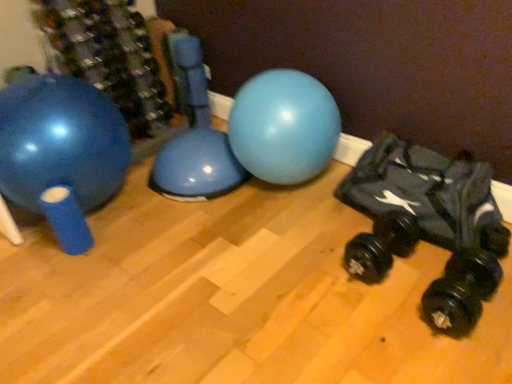
Question: Is black rubber dumbbell at lower right, arranged as the first dumbbell when viewed from the left, surrounded by black rubber dumbbell at lower right, the 1th dumbbell when ordered from right to left?

Choices:
 (A) no
 (B) yes

Answer: (A)

Question: Is black rubber dumbbell at lower right, which is counted as the second dumbbell, starting from the left, taller than black rubber dumbbell at lower right, acting as the second dumbbell starting from the right?

Choices:
 (A) no
 (B) yes

Answer: (B)

Question: Considering the relative sizes of black rubber dumbbell at lower right, which is counted as the second dumbbell, starting from the left, and black rubber dumbbell at lower right, arranged as the first dumbbell when viewed from the left, in the image provided, is black rubber dumbbell at lower right, which is counted as the second dumbbell, starting from the left, wider than black rubber dumbbell at lower right, arranged as the first dumbbell when viewed from the left,?

Choices:
 (A) no
 (B) yes

Answer: (A)

Question: Does black rubber dumbbell at lower right, the 1th dumbbell when ordered from right to left, have a smaller size compared to black rubber dumbbell at lower right, arranged as the first dumbbell when viewed from the left?

Choices:
 (A) yes
 (B) no

Answer: (A)

Question: Is black rubber dumbbell at lower right, the 1th dumbbell when ordered from right to left, shorter than black rubber dumbbell at lower right, arranged as the first dumbbell when viewed from the left?

Choices:
 (A) yes
 (B) no

Answer: (B)

Question: Is black rubber dumbbell at lower right, acting as the second dumbbell starting from the right, in front of or behind black rubber dumbbell at lower right, which is counted as the second dumbbell, starting from the left, in the image?

Choices:
 (A) front
 (B) behind

Answer: (B)

Question: From the image's perspective, is black rubber dumbbell at lower right, arranged as the first dumbbell when viewed from the left, positioned above or below black rubber dumbbell at lower right, which is counted as the second dumbbell, starting from the left?

Choices:
 (A) below
 (B) above

Answer: (B)

Question: Based on their positions, is black rubber dumbbell at lower right, acting as the second dumbbell starting from the right, located to the left or right of black rubber dumbbell at lower right, the 1th dumbbell when ordered from right to left?

Choices:
 (A) right
 (B) left

Answer: (B)

Question: From a real-world perspective, is black rubber dumbbell at lower right, acting as the second dumbbell starting from the right, physically located above or below black rubber dumbbell at lower right, the 1th dumbbell when ordered from right to left?

Choices:
 (A) below
 (B) above

Answer: (A)

Question: Is point pyautogui.click(x=478, y=304) positioned closer to the camera than point pyautogui.click(x=9, y=130)?

Choices:
 (A) farther
 (B) closer

Answer: (B)

Question: Looking at the image, does black rubber dumbbell at lower right, which is counted as the second dumbbell, starting from the left, seem bigger or smaller compared to matte blue exercise ball at left?

Choices:
 (A) small
 (B) big

Answer: (A)

Question: Which is correct: black rubber dumbbell at lower right, the 1th dumbbell when ordered from right to left, is inside matte blue exercise ball at left, or outside of it?

Choices:
 (A) inside
 (B) outside

Answer: (B)

Question: From a real-world perspective, is black rubber dumbbell at lower right, which is counted as the second dumbbell, starting from the left, above or below matte blue exercise ball at left?

Choices:
 (A) above
 (B) below

Answer: (B)

Question: Considering the relative positions of matte blue exercise ball at left and black rubber dumbbell at lower right, which is counted as the second dumbbell, starting from the left, in the image provided, is matte blue exercise ball at left to the left or to the right of black rubber dumbbell at lower right, which is counted as the second dumbbell, starting from the left,?

Choices:
 (A) right
 (B) left

Answer: (B)

Question: Considering the positions of point (23, 91) and point (431, 286), is point (23, 91) closer or farther from the camera than point (431, 286)?

Choices:
 (A) farther
 (B) closer

Answer: (A)